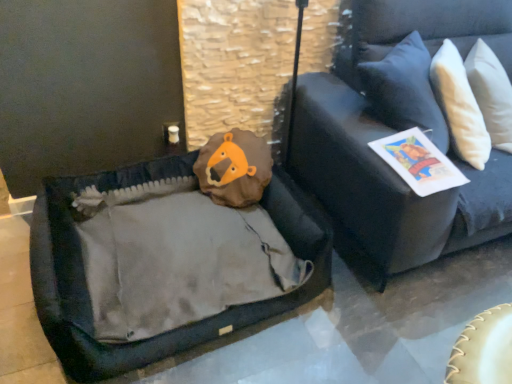
Question: From a real-world perspective, is white paper magazine at upper right above or below velvet dark blue couch at upper right?

Choices:
 (A) below
 (B) above

Answer: (A)

Question: Considering the positions of white paper magazine at upper right and velvet dark blue couch at upper right in the image, is white paper magazine at upper right wider or thinner than velvet dark blue couch at upper right?

Choices:
 (A) thin
 (B) wide

Answer: (A)

Question: Considering the positions of point (449, 183) and point (357, 112), is point (449, 183) closer or farther from the camera than point (357, 112)?

Choices:
 (A) closer
 (B) farther

Answer: (A)

Question: Would you say velvet dark blue couch at upper right is to the left or to the right of white paper magazine at upper right in the picture?

Choices:
 (A) right
 (B) left

Answer: (A)

Question: From a real-world perspective, is velvet dark blue couch at upper right physically located above or below white paper magazine at upper right?

Choices:
 (A) above
 (B) below

Answer: (A)

Question: Does point (314, 76) appear closer or farther from the camera than point (449, 188)?

Choices:
 (A) closer
 (B) farther

Answer: (B)

Question: Considering their positions, is velvet dark blue couch at upper right located in front of or behind white paper magazine at upper right?

Choices:
 (A) front
 (B) behind

Answer: (A)